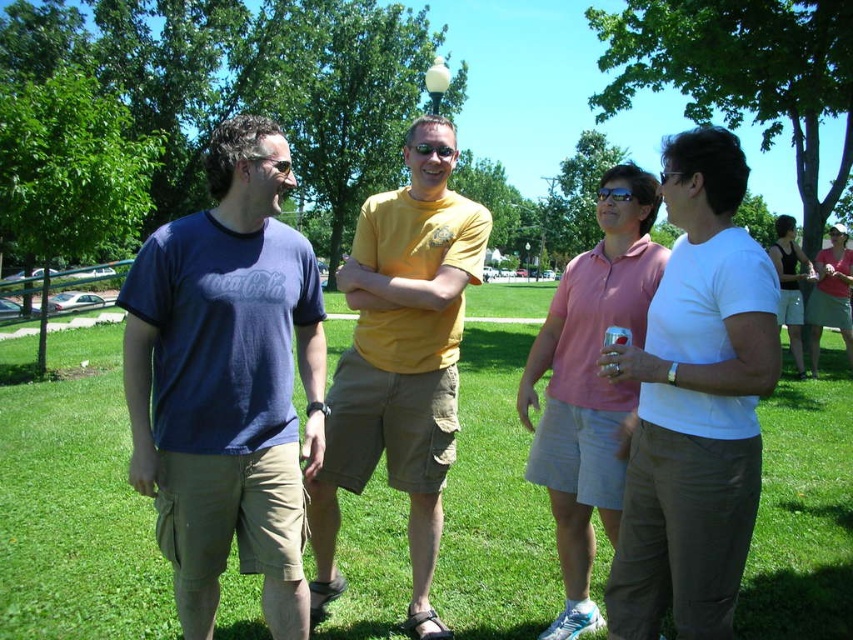
Question: Can you confirm if green grass at center is thinner than white matte shirt at center?

Choices:
 (A) no
 (B) yes

Answer: (A)

Question: Which object is the farthest from the yellow matte t-shirt at center?

Choices:
 (A) pink cotton polo shirt at center
 (B) white matte shirt at center
 (C) green grass at center
 (D) matte blue t-shirt at center

Answer: (C)

Question: Does green grass at center have a smaller size compared to white matte shirt at center?

Choices:
 (A) no
 (B) yes

Answer: (A)

Question: Based on their relative distances, which object is nearer to the matte blue t-shirt at center?

Choices:
 (A) yellow matte t-shirt at center
 (B) white matte shirt at center

Answer: (A)

Question: Considering the real-world distances, which object is closest to the yellow matte t-shirt at center?

Choices:
 (A) matte blue t-shirt at center
 (B) green grass at center

Answer: (A)

Question: Is matte blue t-shirt at center bigger than pink cotton polo shirt at center?

Choices:
 (A) yes
 (B) no

Answer: (B)